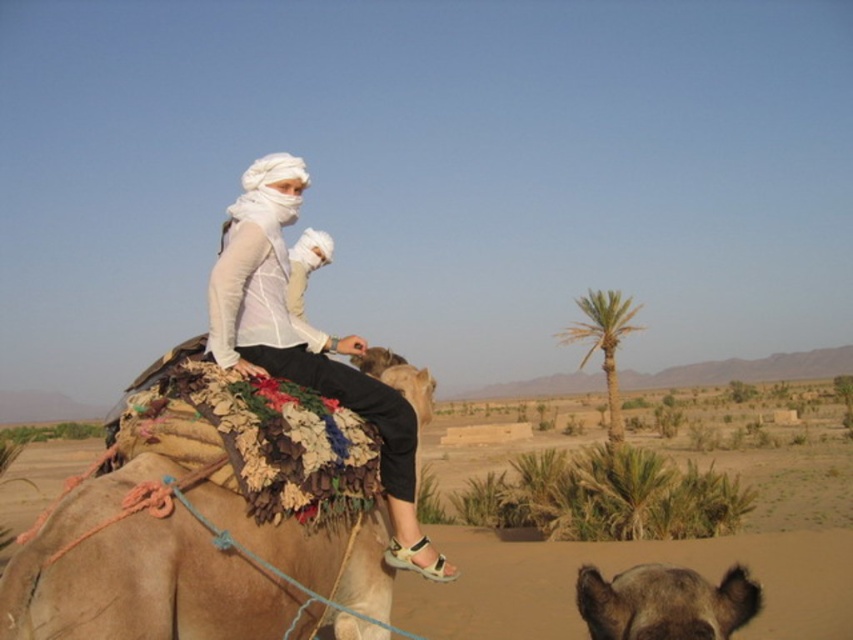
You are standing at the point labeled point (x=259, y=186). You want to throw a rope to the camel in the foreground. The rope you have is 4 meters long. Will it reach?

The distance between you and the camel is 4.43 meters, which is longer than your 4 meter rope. The rope will not reach.

You are a photographer trying to capture a closeup shot of the beige textured saddle at center and the white matte clothing at center. Your camera has a minimum focusing distance of 30 inches. Can you take a clear photo of both objects without moving the camera?

The distance between the beige textured saddle at center and the white matte clothing at center is 33.60 inches, which is greater than the camera minimum focusing distance of 30 inches. Therefore, you can take a clear photo of both objects without moving the camera.

You are a photographer trying to capture the camel rider in the desert scene. You notice two points marked in the image. The first point is at coordinates point (x=155, y=497) and the second is at point (x=215, y=291). From the rider on the camel, which point is closer to the front of the camel?

Point (x=155, y=497) is in front of point (x=215, y=291), so the point closer to the front of the camel would be point (x=155, y=497).